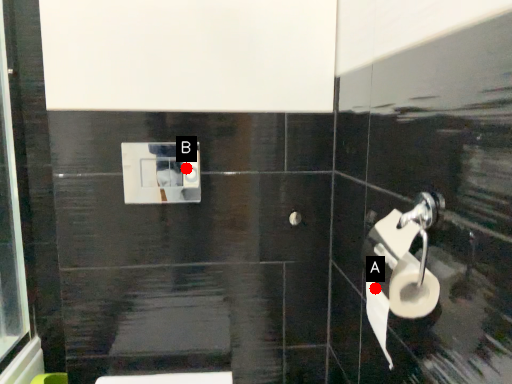
Question: Two points are circled on the image, labeled by A and B beside each circle. Among these points, which one is farthest from the camera?

Choices:
 (A) A is further
 (B) B is further

Answer: (B)